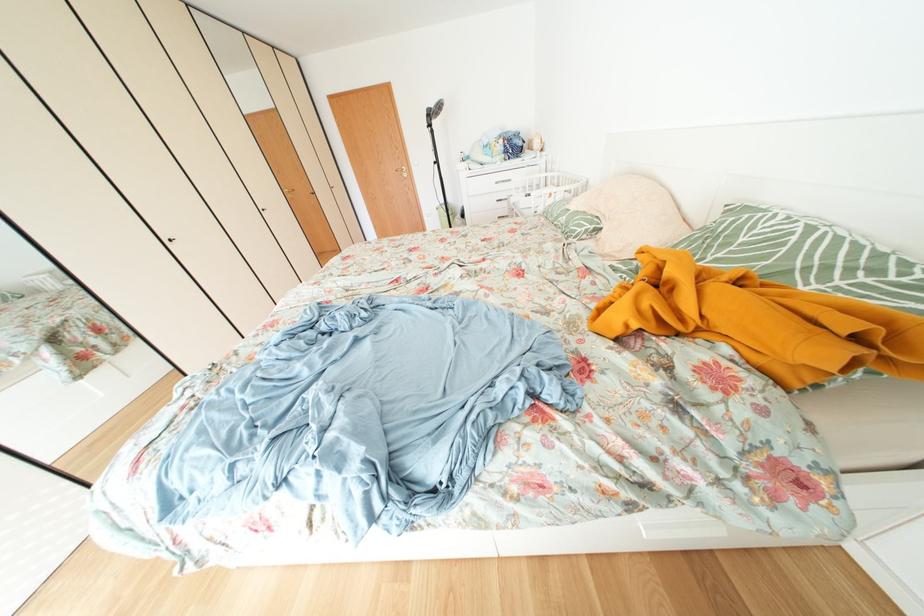
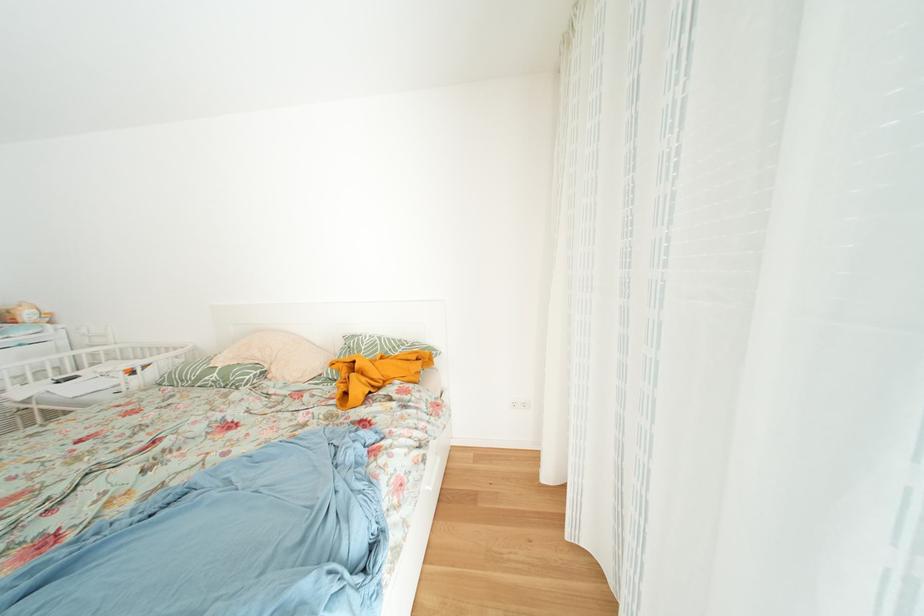
Question: The camera is either moving clockwise (left) or counter-clockwise (right) around the object. The first image is from the beginning of the video and the second image is from the end. Is the camera moving left or right when shooting the video?

Choices:
 (A) Left
 (B) Right

Answer: (A)